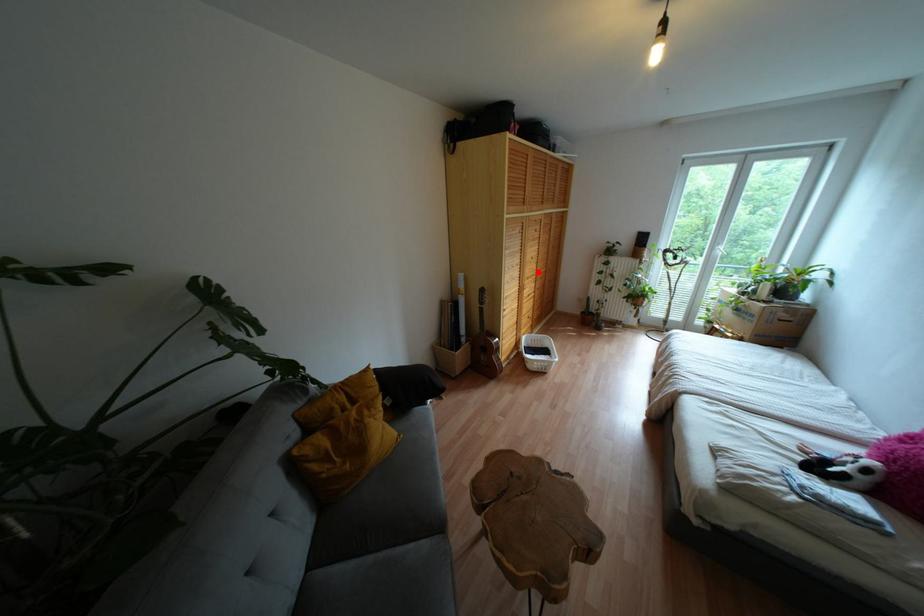
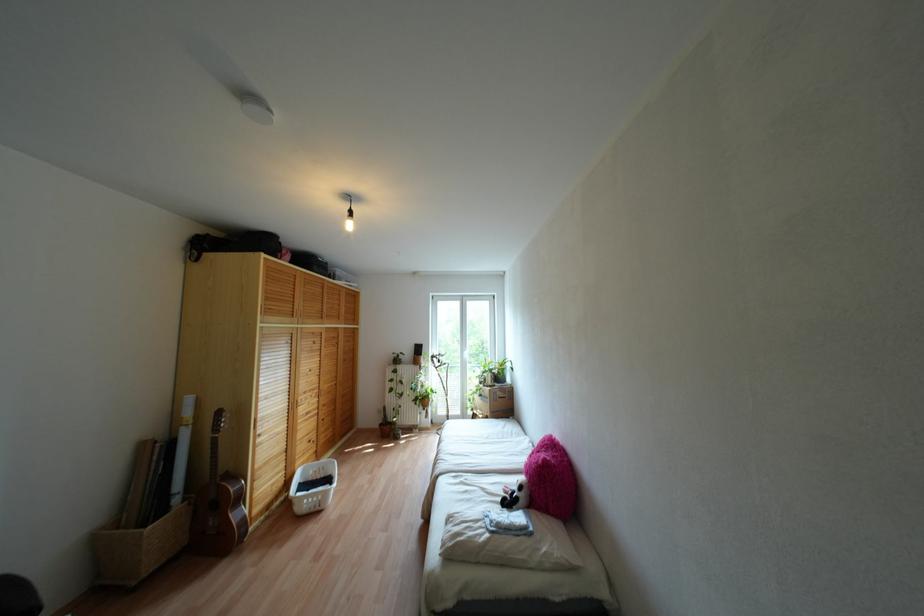
Locate, in the second image, the point that corresponds to the highlighted location in the first image.

(324, 387)